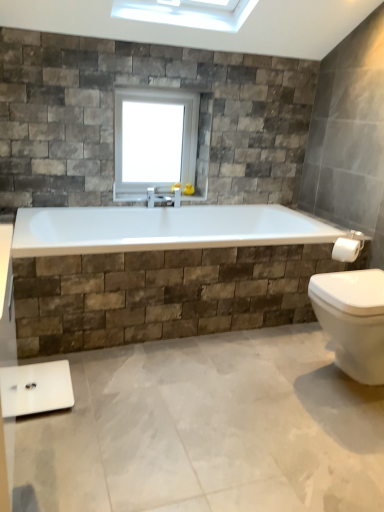
I want to click on white glossy towel bar at right, so click(x=347, y=249).

Find the location of a particular element. white glossy scale at lower left is located at coordinates click(36, 388).

The width and height of the screenshot is (384, 512). What are the coordinates of `white glossy towel bar at right` in the screenshot? It's located at (347, 249).

Does white glossy scale at lower left appear on the left side of white glossy towel bar at right?

Yes.

Are white glossy scale at lower left and white glossy towel bar at right located far from each other?

white glossy scale at lower left is positioned a significant distance from white glossy towel bar at right.

From the image's perspective, who appears lower, white glossy scale at lower left or white glossy towel bar at right?

white glossy scale at lower left appears lower in the image.

Does white glossy scale at lower left have a smaller size compared to white glossy towel bar at right?

No, white glossy scale at lower left is not smaller than white glossy towel bar at right.

In terms of height, does white glass window at upper center look taller or shorter compared to white glossy scale at lower left?

Clearly, white glass window at upper center is taller compared to white glossy scale at lower left.

Is white glass window at upper center positioned behind white glossy scale at lower left?

Yes, it is behind white glossy scale at lower left.

From a real-world perspective, is white glass window at upper center on top of white glossy scale at lower left?

Yes, from a real-world perspective, white glass window at upper center is over white glossy scale at lower left

What's the angular difference between white glass window at upper center and white glossy scale at lower left's facing directions?

The angular difference between white glass window at upper center and white glossy scale at lower left is 0.195 degrees.

Based on the photo, measure the distance from white glossy towel bar at right to white glossy scale at lower left.

A distance of 5.61 feet exists between white glossy towel bar at right and white glossy scale at lower left.

From a real-world perspective, who is located lower, white glossy towel bar at right or white glossy scale at lower left?

white glossy scale at lower left, from a real-world perspective.

Is white glossy towel bar at right outside of white glossy scale at lower left?

Yes, white glossy towel bar at right is outside of white glossy scale at lower left.

Is the surface of white glossy towel bar at right in direct contact with white glossy scale at lower left?

No, white glossy towel bar at right is not with white glossy scale at lower left.

Which of these two, white glossy scale at lower left or white glass window at upper center, is thinner?

white glass window at upper center is thinner.

Is white glossy scale at lower left aimed at white glass window at upper center?

No, white glossy scale at lower left is not facing towards white glass window at upper center.

Which is more to the left, white glossy scale at lower left or white glass window at upper center?

Positioned to the left is white glossy scale at lower left.

Is white glossy scale at lower left in contact with white glass window at upper center?

There is a gap between white glossy scale at lower left and white glass window at upper center.

Is white glossy towel bar at right to the right of white glass window at upper center from the viewer's perspective?

Indeed, white glossy towel bar at right is positioned on the right side of white glass window at upper center.

Based on the photo, how different are the orientations of white glossy towel bar at right and white glass window at upper center in degrees?

The angle between the facing direction of white glossy towel bar at right and the facing direction of white glass window at upper center is 57.7 degrees.

Where is `window above the white glossy towel bar at right (from a real-world perspective)`? The height and width of the screenshot is (512, 384). window above the white glossy towel bar at right (from a real-world perspective) is located at coordinates (158, 140).

Based on the photo, from a real-world perspective, which object stands above the other?

From a 3D spatial view, white glass window at upper center is above.

Between white glass window at upper center and white glossy towel bar at right, which one appears on the right side from the viewer's perspective?

white glossy towel bar at right is more to the right.

How much distance is there between white glass window at upper center and white glossy towel bar at right?

A distance of 1.36 meters exists between white glass window at upper center and white glossy towel bar at right.

How different are the orientations of white glass window at upper center and white glossy towel bar at right in degrees?

The angle between the facing direction of white glass window at upper center and the facing direction of white glossy towel bar at right is 57.7 degrees.

Considering the relative sizes of white glass window at upper center and white glossy towel bar at right in the image provided, is white glass window at upper center smaller than white glossy towel bar at right?

Incorrect, white glass window at upper center is not smaller in size than white glossy towel bar at right.

Identify the location of scale directly beneath the white glossy towel bar at right (from a real-world perspective). (36, 388).

Where is `window lying behind the white glossy scale at lower left`? The image size is (384, 512). window lying behind the white glossy scale at lower left is located at coordinates (158, 140).

Looking at the image, which one is located closer to white glass window at upper center, white glossy scale at lower left or white glossy towel bar at right?

Among the two, white glossy towel bar at right is located nearer to white glass window at upper center.

Which object lies nearer to the anchor point white glossy scale at lower left, white glossy towel bar at right or white glass window at upper center?

The object closer to white glossy scale at lower left is white glass window at upper center.

Considering their positions, is white glass window at upper center positioned further to white glossy scale at lower left than white glossy towel bar at right?

Among the two, white glossy towel bar at right is located further to white glossy scale at lower left.

Based on their spatial positions, is white glossy towel bar at right or white glossy scale at lower left further from white glass window at upper center?

The object further to white glass window at upper center is white glossy scale at lower left.

Considering their positions, is white glossy scale at lower left positioned further to white glossy towel bar at right than white glass window at upper center?

The object further to white glossy towel bar at right is white glossy scale at lower left.

Considering their positions, is white glass window at upper center positioned further to white glossy towel bar at right than white glossy scale at lower left?

white glossy scale at lower left.

This screenshot has width=384, height=512. I want to click on window between white glossy scale at lower left and white glossy towel bar at right from left to right, so click(158, 140).